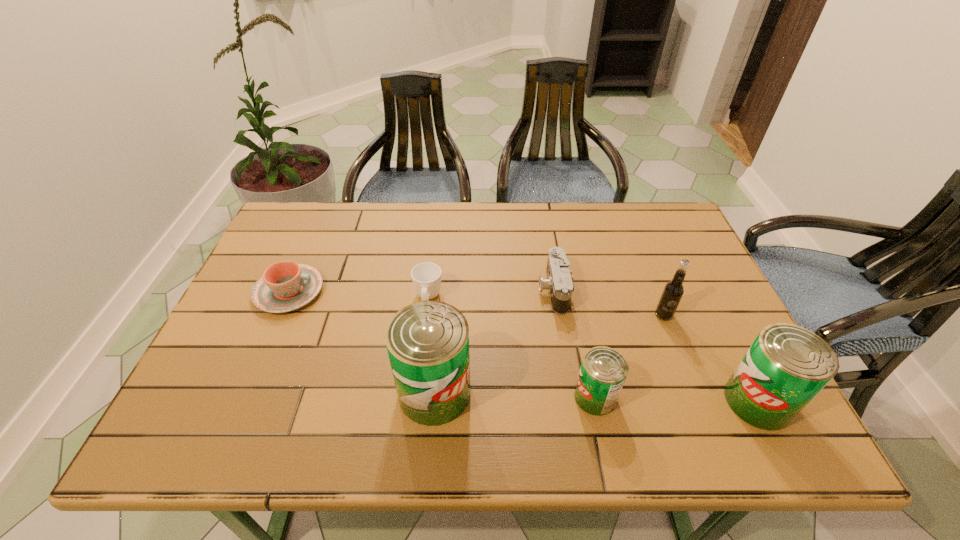
This screenshot has width=960, height=540. Find the location of `vacant area situated 0.100m on the right of the shortest can`. vacant area situated 0.100m on the right of the shortest can is located at coordinates (661, 397).

Find the location of `vacant area located 0.330m on the back of the rightmost object`. vacant area located 0.330m on the back of the rightmost object is located at coordinates (694, 274).

Find the location of `vacant region located 0.050m on the label of the root beer`. vacant region located 0.050m on the label of the root beer is located at coordinates (672, 338).

You are a GUI agent. You are given a task and a screenshot of the screen. Output one action in this format:
    pyautogui.click(x=<x>, y=<y>)
    Task: Click on the vacant space situated 0.300m on the lens of the camera
    The image size is (960, 540).
    Given the screenshot: What is the action you would take?
    pyautogui.click(x=427, y=289)

Locate an element on the screen. The height and width of the screenshot is (540, 960). vacant space located 0.200m on the lens of the camera is located at coordinates (465, 289).

Find the location of a particular element. The width and height of the screenshot is (960, 540). free point located 0.270m on the lens of the camera is located at coordinates (439, 289).

This screenshot has height=540, width=960. I want to click on blank space located 0.310m on the handle side of the chinaware, so click(438, 291).

This screenshot has width=960, height=540. In order to click on free region located 0.170m with the handle on the side of the cup in this screenshot , I will do `click(420, 370)`.

Find the location of a particular element. object present at the left edge is located at coordinates (285, 286).

Where is `can at the right edge`? The image size is (960, 540). can at the right edge is located at coordinates (787, 365).